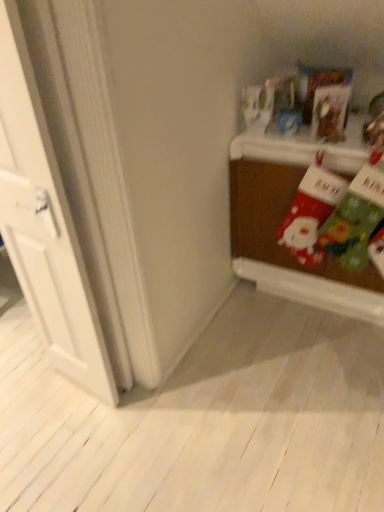
Question: Is wooden table at right not close to white wood door at left?

Choices:
 (A) no
 (B) yes

Answer: (A)

Question: Is wooden table at right behind white wood door at left?

Choices:
 (A) no
 (B) yes

Answer: (B)

Question: Does wooden table at right have a lesser width compared to white wood door at left?

Choices:
 (A) no
 (B) yes

Answer: (A)

Question: Is wooden table at right closer to the viewer compared to white wood door at left?

Choices:
 (A) yes
 (B) no

Answer: (B)

Question: Considering the relative sizes of wooden table at right and white wood door at left in the image provided, is wooden table at right taller than white wood door at left?

Choices:
 (A) yes
 (B) no

Answer: (B)

Question: From the image's perspective, does wooden table at right appear higher than white wood door at left?

Choices:
 (A) yes
 (B) no

Answer: (A)

Question: Considering the relative positions of white wood door at left and wooden table at right in the image provided, is white wood door at left to the left of wooden table at right from the viewer's perspective?

Choices:
 (A) no
 (B) yes

Answer: (B)

Question: Is the depth of white wood door at left greater than that of wooden table at right?

Choices:
 (A) no
 (B) yes

Answer: (A)

Question: Would you say white wood door at left contains wooden table at right?

Choices:
 (A) no
 (B) yes

Answer: (A)

Question: Does white wood door at left come in front of wooden table at right?

Choices:
 (A) no
 (B) yes

Answer: (B)

Question: Can you confirm if white wood door at left is smaller than wooden table at right?

Choices:
 (A) no
 (B) yes

Answer: (B)

Question: Considering the relative sizes of white wood door at left and wooden table at right in the image provided, is white wood door at left shorter than wooden table at right?

Choices:
 (A) yes
 (B) no

Answer: (B)

Question: Considering the positions of wooden table at right and white wood door at left in the image, is wooden table at right bigger or smaller than white wood door at left?

Choices:
 (A) big
 (B) small

Answer: (A)